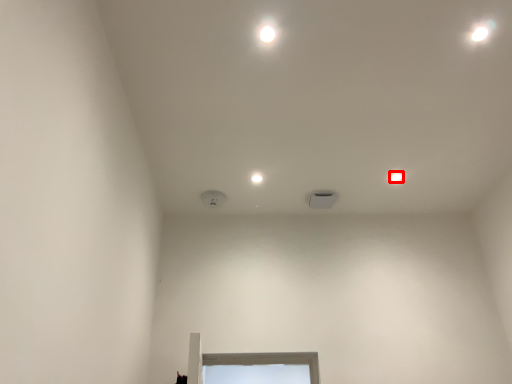
Question: From the image, what is the correct spatial relationship of dot (annotated by the red box) in relation to dot?

Choices:
 (A) left
 (B) right

Answer: (B)